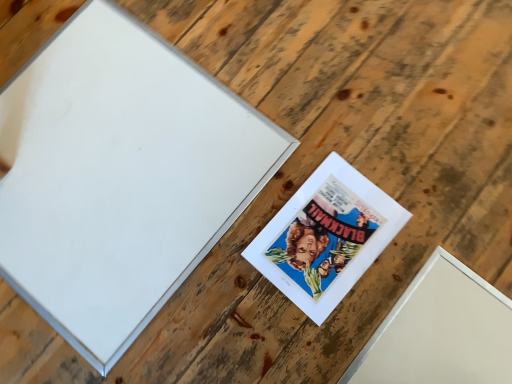
Identify the location of free space that is in between matte paper picture frame at center, placed as the 2th picture frame when sorted from left to right, and white matte picture frame at upper left, which is counted as the first picture frame, starting from the left. The image size is (512, 384). (x=232, y=259).